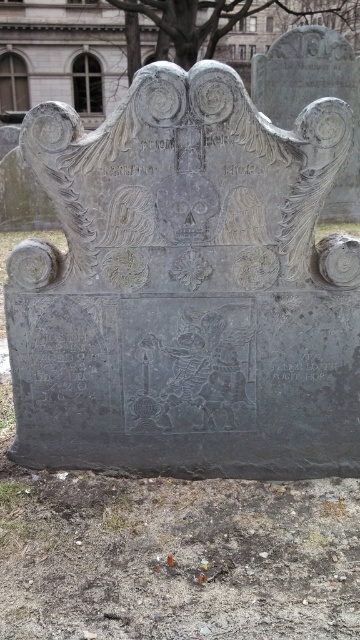
Measure the distance between gray stone gravestone at center and camera.

They are 2.47 meters apart.

Is gray stone gravestone at center smaller than black stone inscription at center?

Actually, gray stone gravestone at center might be larger than black stone inscription at center.

Who is more forward, [267,136] or [330,362]?

Point [267,136] is more forward.

This screenshot has height=640, width=360. I want to click on gray stone gravestone at center, so click(x=185, y=285).